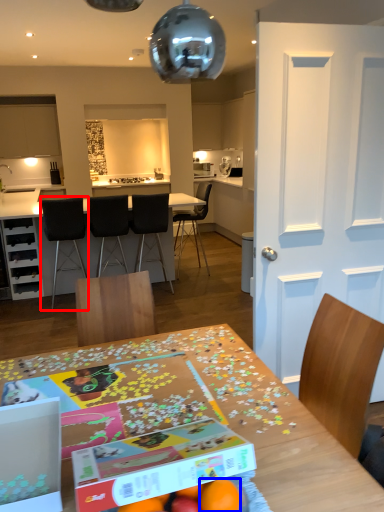
Question: Which object appears farthest to the camera in this image, chair (highlighted by a red box) or orange (highlighted by a blue box)?

Choices:
 (A) chair
 (B) orange

Answer: (A)